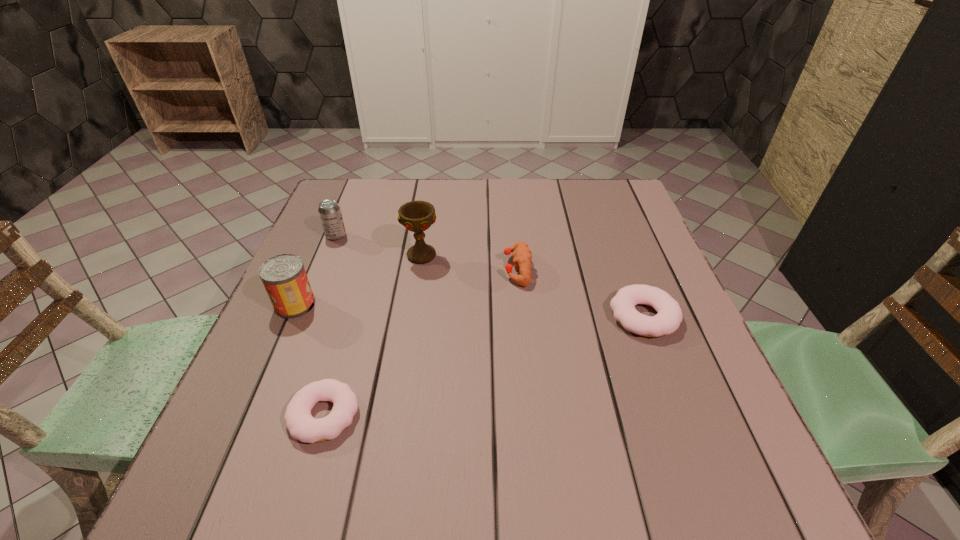
Locate an element on the screen. the nearer doughnut is located at coordinates point(301,425).

In order to click on the shorter doughnut in this screenshot , I will do `click(301, 425)`.

The image size is (960, 540). Identify the location of the right doughnut. (667, 320).

Identify the location of the farther doughnut. Image resolution: width=960 pixels, height=540 pixels. (667, 320).

You are a GUI agent. You are given a task and a screenshot of the screen. Output one action in this format:
    pyautogui.click(x=<x>, y=<y>)
    Task: Click on the puncher
    
    Given the screenshot: What is the action you would take?
    pyautogui.click(x=522, y=255)

Find the location of a particular element. This screenshot has height=540, width=960. the fourth tallest object is located at coordinates (522, 255).

You are a GUI agent. You are given a task and a screenshot of the screen. Output one action in this format:
    pyautogui.click(x=<x>, y=<y>)
    Task: Click on the beer can
    
    Given the screenshot: What is the action you would take?
    [329, 210]

Identify the location of chalice. The image size is (960, 540). (417, 216).

In order to click on the tallest object in this screenshot , I will do `click(417, 216)`.

Image resolution: width=960 pixels, height=540 pixels. I want to click on can, so click(x=284, y=277).